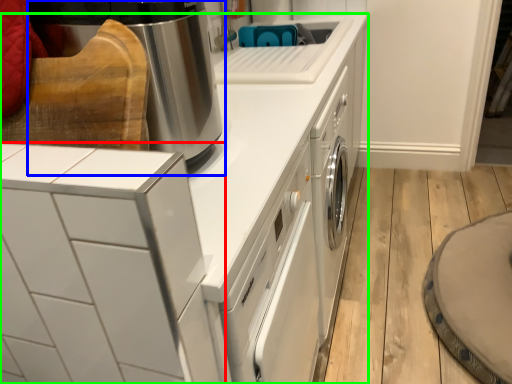
Question: Which object is the farthest from home appliance (highlighted by a red box)? Choose among these: home appliance (highlighted by a blue box) or home appliance (highlighted by a green box).

Choices:
 (A) home appliance
 (B) home appliance

Answer: (A)